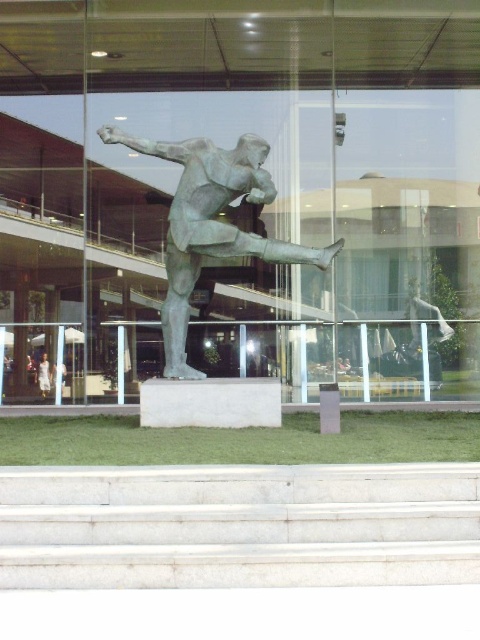
Between white marble stairs at center and green patina statue at center, which one is positioned lower?

white marble stairs at center is below.

The image size is (480, 640). What do you see at coordinates (239, 525) in the screenshot?
I see `white marble stairs at center` at bounding box center [239, 525].

Locate an element on the screen. This screenshot has width=480, height=640. white marble stairs at center is located at coordinates (239, 525).